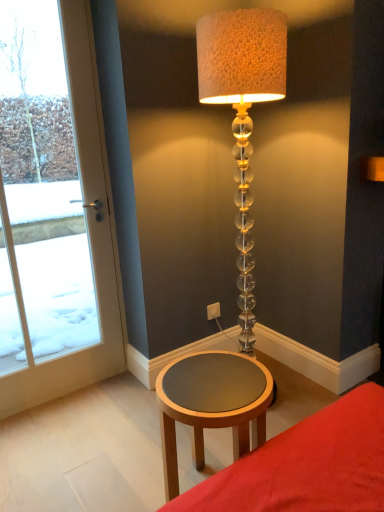
What do you see at coordinates (242, 112) in the screenshot? The width and height of the screenshot is (384, 512). I see `translucent glass lamp at center` at bounding box center [242, 112].

The width and height of the screenshot is (384, 512). What do you see at coordinates (213, 311) in the screenshot? I see `white plastic electric outlet at lower center` at bounding box center [213, 311].

You are a GUI agent. You are given a task and a screenshot of the screen. Output one action in this format:
    pyautogui.click(x=<x>, y=<y>)
    Task: Click on the wooden round table at lower center
    
    Given the screenshot: What is the action you would take?
    pyautogui.click(x=211, y=405)

Considering the sizes of objects translucent glass lamp at center and matte brown table at lower center in the image provided, who is bigger, translucent glass lamp at center or matte brown table at lower center?

translucent glass lamp at center.

Is translucent glass lamp at center to the left of matte brown table at lower center from the viewer's perspective?

Yes.

Based on the photo, from the image's perspective, which one is positioned higher, translucent glass lamp at center or matte brown table at lower center?

translucent glass lamp at center, from the image's perspective.

Could you tell me if translucent glass lamp at center is turned towards matte brown table at lower center?

No, translucent glass lamp at center is not oriented towards matte brown table at lower center.

Looking at this image, considering the relative sizes of wooden round table at lower center and white glass door at left in the image provided, is wooden round table at lower center taller than white glass door at left?

In fact, wooden round table at lower center may be shorter than white glass door at left.

Is wooden round table at lower center positioned with its back to white glass door at left?

Absolutely, wooden round table at lower center is directed away from white glass door at left.

From a real-world perspective, which is physically above, wooden round table at lower center or white glass door at left?

In real-world perspective, white glass door at left is above.

From the image's perspective, would you say wooden round table at lower center is positioned over white glass door at left?

No, from the image's perspective, wooden round table at lower center is not over white glass door at left.

From the picture: In terms of height, does white plastic electric outlet at lower center look taller or shorter compared to wooden round table at lower center?

In the image, white plastic electric outlet at lower center appears to be shorter than wooden round table at lower center.

How different are the orientations of white plastic electric outlet at lower center and wooden round table at lower center in degrees?

The angular difference between white plastic electric outlet at lower center and wooden round table at lower center is 4.88 degrees.

Is white plastic electric outlet at lower center aimed at wooden round table at lower center?

No, white plastic electric outlet at lower center is not facing towards wooden round table at lower center.

Is white plastic electric outlet at lower center bigger or smaller than white glass door at left?

In the image, white plastic electric outlet at lower center appears to be smaller than white glass door at left.

From a real-world perspective, relative to white glass door at left, is white plastic electric outlet at lower center vertically above or below?

In terms of real-world spatial position, white plastic electric outlet at lower center is below white glass door at left.

Considering the relative positions of white plastic electric outlet at lower center and white glass door at left in the image provided, is white plastic electric outlet at lower center to the left of white glass door at left from the viewer's perspective?

No.

Would you consider white plastic electric outlet at lower center to be distant from white glass door at left?

Yes, white plastic electric outlet at lower center and white glass door at left are located far from each other.

In the image, is white glass door at left positioned in front of or behind translucent glass lamp at center?

Clearly, white glass door at left is behind translucent glass lamp at center.

Is white glass door at left next to translucent glass lamp at center and touching it?

No, white glass door at left is not with translucent glass lamp at center.

Can you confirm if white glass door at left is smaller than translucent glass lamp at center?

Yes, white glass door at left is smaller than translucent glass lamp at center.

Is white glass door at left looking in the opposite direction of translucent glass lamp at center?

white glass door at left is not turned away from translucent glass lamp at center.

Is white plastic electric outlet at lower center in contact with matte brown table at lower center?

No, white plastic electric outlet at lower center is not next to matte brown table at lower center.

From a real-world perspective, who is located higher, white plastic electric outlet at lower center or matte brown table at lower center?

white plastic electric outlet at lower center is physically above.

Where is `furniture located in front of the white plastic electric outlet at lower center`? furniture located in front of the white plastic electric outlet at lower center is located at coordinates (306, 465).

Considering the relative sizes of white plastic electric outlet at lower center and matte brown table at lower center in the image provided, is white plastic electric outlet at lower center smaller than matte brown table at lower center?

Indeed, white plastic electric outlet at lower center has a smaller size compared to matte brown table at lower center.

From a real-world perspective, which object rests below the other?

In real-world perspective, white plastic electric outlet at lower center is lower.

Are translucent glass lamp at center and white plastic electric outlet at lower center located far from each other?

Yes, translucent glass lamp at center is far from white plastic electric outlet at lower center.

How distant is translucent glass lamp at center from white plastic electric outlet at lower center?

The distance of translucent glass lamp at center from white plastic electric outlet at lower center is 1.28 meters.

Locate an element on the screen. Image resolution: width=384 pixels, height=512 pixels. lamp behind the matte brown table at lower center is located at coordinates (242, 112).

The height and width of the screenshot is (512, 384). I want to click on table below the white glass door at left (from the image's perspective), so click(x=211, y=405).

Estimate the real-world distances between objects in this image. Which object is further from white plastic electric outlet at lower center, translucent glass lamp at center or wooden round table at lower center?

Based on the image, translucent glass lamp at center appears to be further to white plastic electric outlet at lower center.

Looking at the image, which one is located closer to translucent glass lamp at center, matte brown table at lower center or wooden round table at lower center?

Among the two, wooden round table at lower center is located nearer to translucent glass lamp at center.

Looking at the image, which one is located closer to translucent glass lamp at center, white glass door at left or matte brown table at lower center?

matte brown table at lower center lies closer to translucent glass lamp at center than the other object.

Considering their positions, is wooden round table at lower center positioned closer to matte brown table at lower center than translucent glass lamp at center?

Among the two, wooden round table at lower center is located nearer to matte brown table at lower center.

Based on their spatial positions, is white glass door at left or white plastic electric outlet at lower center closer to matte brown table at lower center?

white plastic electric outlet at lower center lies closer to matte brown table at lower center than the other object.

From the image, which object appears to be farther from wooden round table at lower center, matte brown table at lower center or white plastic electric outlet at lower center?

The object further to wooden round table at lower center is white plastic electric outlet at lower center.

Based on the photo, estimate the real-world distances between objects in this image. Which object is closer to wooden round table at lower center, translucent glass lamp at center or white plastic electric outlet at lower center?

Based on the image, white plastic electric outlet at lower center appears to be nearer to wooden round table at lower center.

In the scene shown: Which object lies further to the anchor point matte brown table at lower center, translucent glass lamp at center or white plastic electric outlet at lower center?

translucent glass lamp at center lies further to matte brown table at lower center than the other object.

You are a GUI agent. You are given a task and a screenshot of the screen. Output one action in this format:
    pyautogui.click(x=<x>, y=<y>)
    Task: Click on the table between translucent glass lamp at center and matte brown table at lower center in the vertical direction
    The width and height of the screenshot is (384, 512).
    Given the screenshot: What is the action you would take?
    (211, 405)

Identify the location of window located between matte brown table at lower center and white plastic electric outlet at lower center in the depth direction. The width and height of the screenshot is (384, 512). (44, 182).

The width and height of the screenshot is (384, 512). I want to click on lamp located between wooden round table at lower center and white plastic electric outlet at lower center in the depth direction, so click(x=242, y=112).

Where is `window between wooden round table at lower center and white plastic electric outlet at lower center along the z-axis`? window between wooden round table at lower center and white plastic electric outlet at lower center along the z-axis is located at coordinates (44, 182).